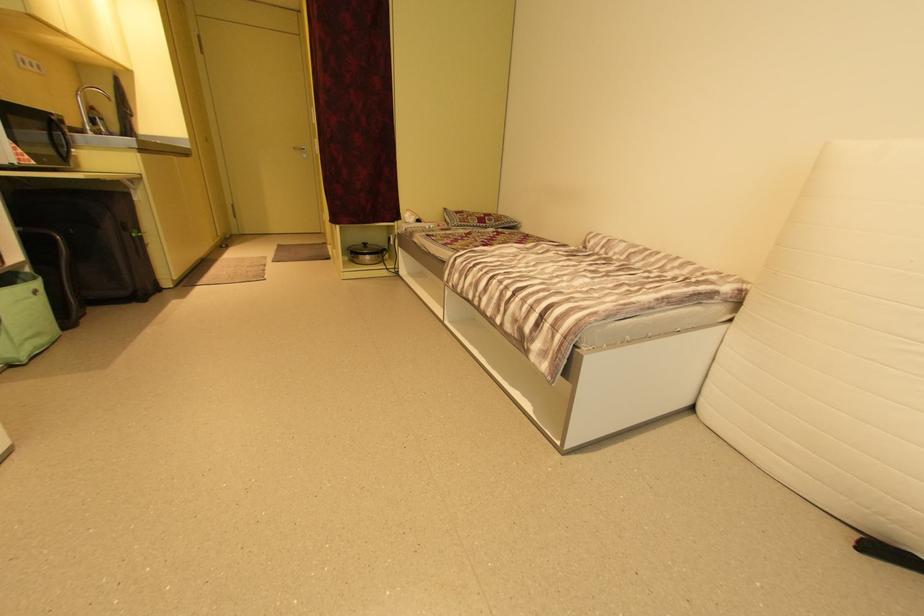
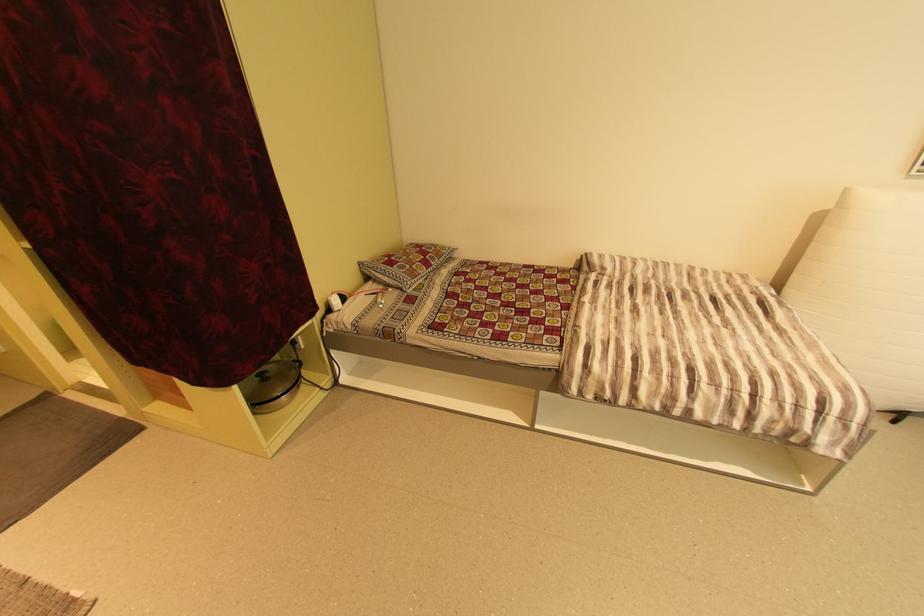
Where in the second image is the point corresponding to [476,217] from the first image?

(420, 267)